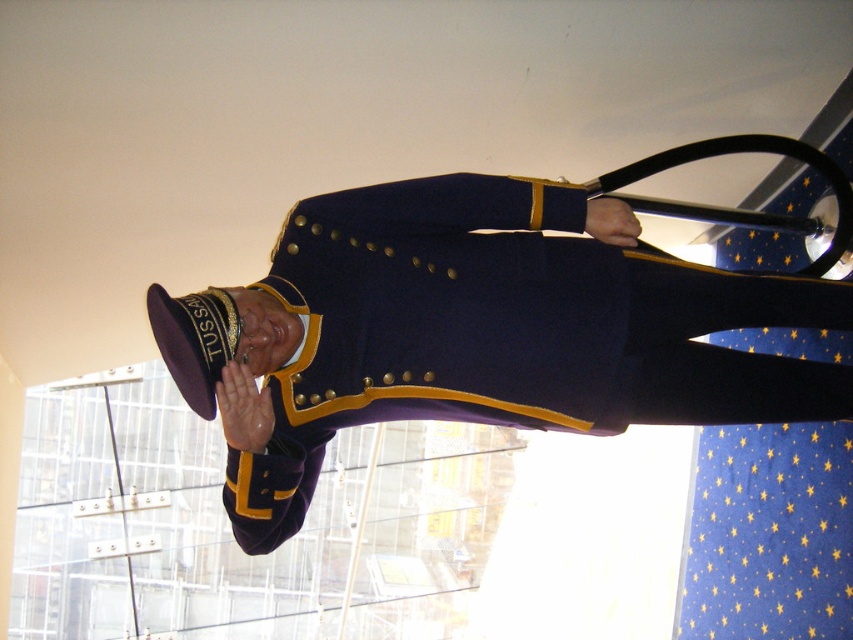
Question: Is navy wool uniform at center bigger than maroon felt hat at center?

Choices:
 (A) yes
 (B) no

Answer: (A)

Question: Where is navy wool uniform at center located in relation to maroon felt hat at center in the image?

Choices:
 (A) below
 (B) above

Answer: (B)

Question: Among these objects, which one is nearest to the camera?

Choices:
 (A) maroon felt hat at center
 (B) navy wool uniform at center

Answer: (A)

Question: Can you confirm if navy wool uniform at center is wider than maroon felt hat at center?

Choices:
 (A) yes
 (B) no

Answer: (A)

Question: Which object is farther from the camera taking this photo?

Choices:
 (A) navy wool uniform at center
 (B) maroon felt hat at center

Answer: (A)